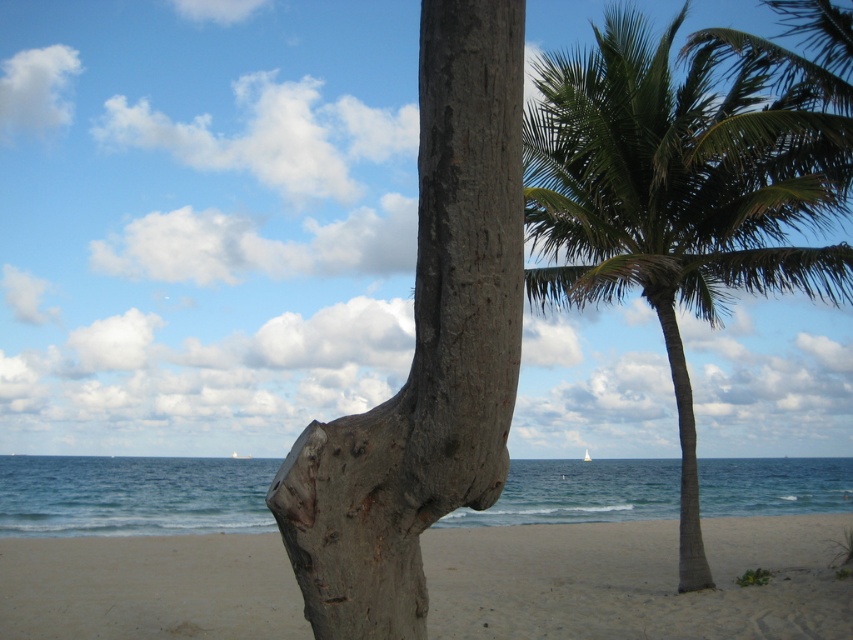
Question: Does green leafy coconut tree at right appear over sandy beige at lower center?

Choices:
 (A) no
 (B) yes

Answer: (B)

Question: Can you confirm if green leafy coconut tree at right is wider than gray rough bark tree trunk at center?

Choices:
 (A) yes
 (B) no

Answer: (A)

Question: Among these objects, which one is nearest to the camera?

Choices:
 (A) sandy beige at lower center
 (B) green leafy coconut tree at right
 (C) gray rough bark tree trunk at center

Answer: (C)

Question: Estimate the real-world distances between objects in this image. Which object is farther from the green leafy coconut tree at right?

Choices:
 (A) gray rough bark tree trunk at center
 (B) sandy beige at lower center

Answer: (A)

Question: Is green leafy coconut tree at right thinner than gray rough bark tree trunk at center?

Choices:
 (A) no
 (B) yes

Answer: (A)

Question: Considering the real-world distances, which object is farthest from the green leafy coconut tree at right?

Choices:
 (A) gray rough bark tree trunk at center
 (B) sandy beige at lower center

Answer: (A)